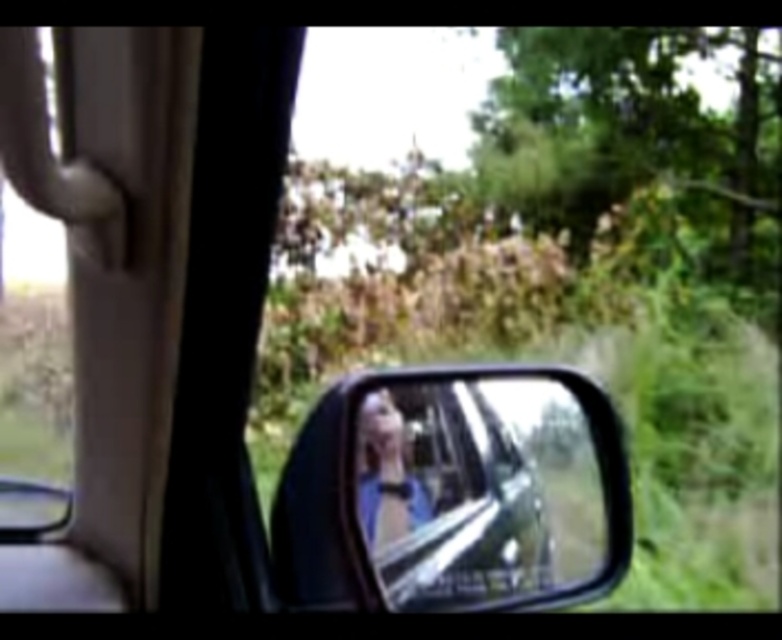
You are a driver checking your side mirror. You see the glossy metallic mirror at center and the blue fabric person at center in the reflection. Which object takes up more space in the mirror?

The glossy metallic mirror at center takes up more space in the mirror than the blue fabric person at center because it is bigger.

You are driving a car and looking at the side mirror. There is a point marked at coordinates (476, 490). What object is located at that point?

The point at coordinates (476, 490) marks the glossy metallic mirror at center.